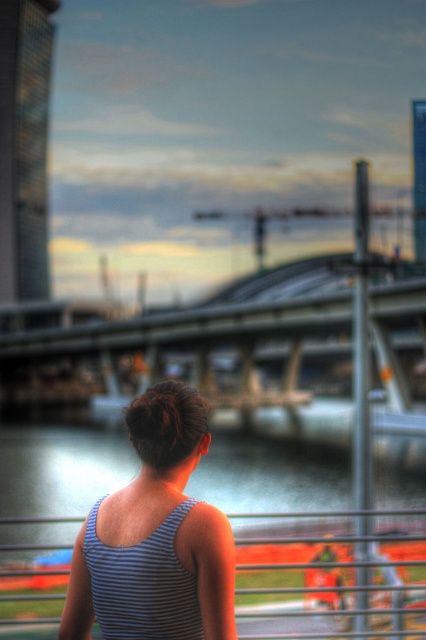
You are standing at the edge of the scene and want to cross to the other side. The concrete bridge at center and the striped fabric tank top at center are in your path. Which object is closer to you that you need to step over first?

The striped fabric tank top at center is closer to you than the concrete bridge at center, so you need to step over the striped fabric tank top at center first before reaching the concrete bridge at center.

You are a fashion designer observing the scene. You need to decide whether the striped fabric tank top at center can be fully covered by the metallic silver rail at center without moving either item. Can it?

The striped fabric tank top at center occupies less space than the metallic silver rail at center, so yes, the metallic silver rail at center can fully cover the striped fabric tank top at center.